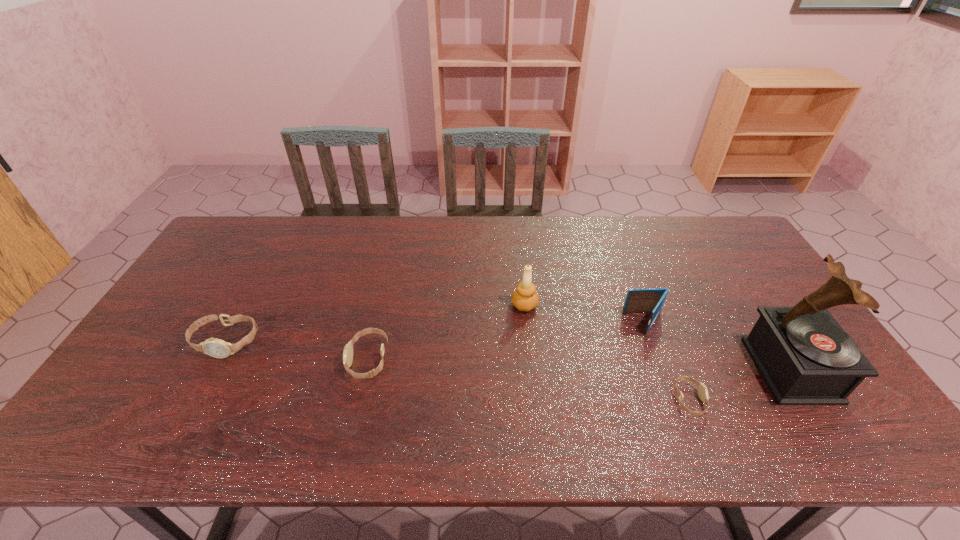
Please point a location where one more watch can be added evenly. Please provide its 2D coordinates. Your answer should be formatted as a tuple, i.e. [(x, y)], where the tuple contains the x and y coordinates of a point satisfying the conditions above.

[(522, 379)]